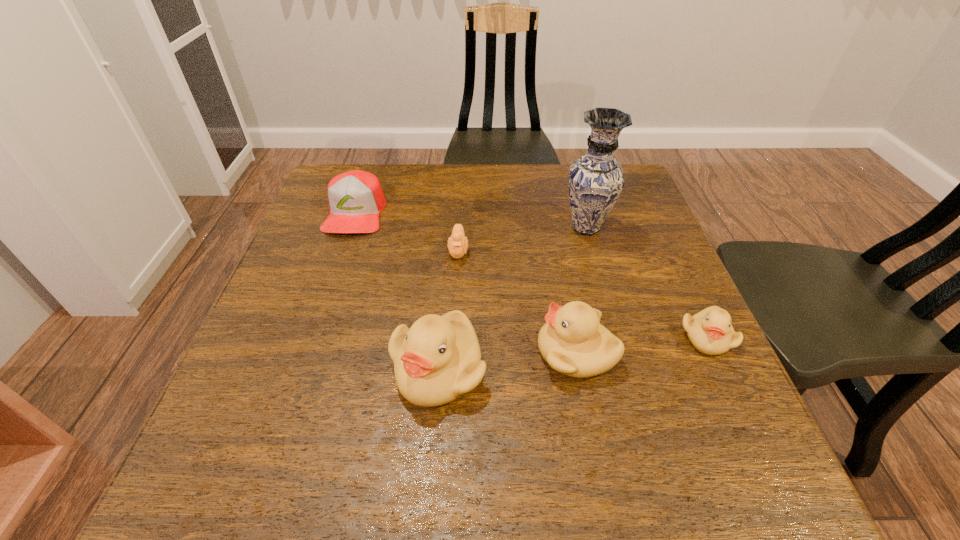
Identify the location of the fourth shortest object. (573, 342).

Find the location of a particular element. The image size is (960, 540). the second duckling from right to left is located at coordinates (573, 342).

Image resolution: width=960 pixels, height=540 pixels. In order to click on the rightmost object in this screenshot , I will do `click(710, 331)`.

Find the location of a particular element. baseball cap is located at coordinates (356, 198).

Locate an element on the screen. The image size is (960, 540). vase is located at coordinates (596, 180).

You are a GUI agent. You are given a task and a screenshot of the screen. Output one action in this format:
    pyautogui.click(x=<x>, y=<y>)
    Task: Click on the shortest object
    The height and width of the screenshot is (540, 960).
    Given the screenshot: What is the action you would take?
    pyautogui.click(x=457, y=244)

Locate an element on the screen. The width and height of the screenshot is (960, 540). the farthest duckling is located at coordinates (457, 244).

Identify the location of free space located 0.300m on the beak of the third duckling from left to right. (378, 353).

Where is `vacant region located on the beak of the third duckling from left to right`? Image resolution: width=960 pixels, height=540 pixels. vacant region located on the beak of the third duckling from left to right is located at coordinates (336, 353).

Locate an element on the screen. free region located 0.400m on the beak of the third duckling from left to right is located at coordinates (325, 353).